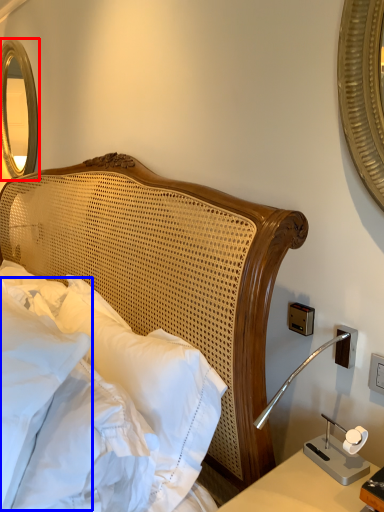
Question: Which of the following is the farthest to the observer, mirror (highlighted by a red box) or pillow (highlighted by a blue box)?

Choices:
 (A) mirror
 (B) pillow

Answer: (A)